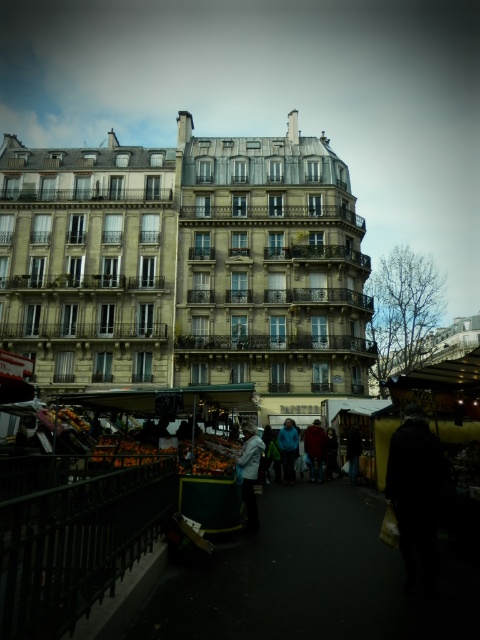
Is black matte coat at lower right wider than dark blue jacket at center?

Yes.

Which is behind, point (418, 547) or point (319, 461)?

Point (319, 461)

Which is behind, point (408, 580) or point (313, 420)?

Positioned behind is point (313, 420).

At what (x,y) coordinates should I click in order to perform the action: click on black matte coat at lower right. Please return your answer as a coordinate pair (x, y). This screenshot has height=640, width=480. Looking at the image, I should click on (416, 492).

Does black matte coat at lower right appear on the left side of dark gray jacket at center?

In fact, black matte coat at lower right is to the right of dark gray jacket at center.

Who is more forward, (423, 577) or (352, 426)?

Positioned in front is point (423, 577).

This screenshot has height=640, width=480. What are the coordinates of `black matte coat at lower right` in the screenshot? It's located at (416, 492).

Looking at this image, between black matte coat at lower right and blue fabric jacket at center, which one is positioned higher?

black matte coat at lower right is above.

Is point (408, 440) positioned behind point (282, 464)?

No, it is in front of (282, 464).

This screenshot has width=480, height=640. Find the location of `black matte coat at lower right`. black matte coat at lower right is located at coordinates (416, 492).